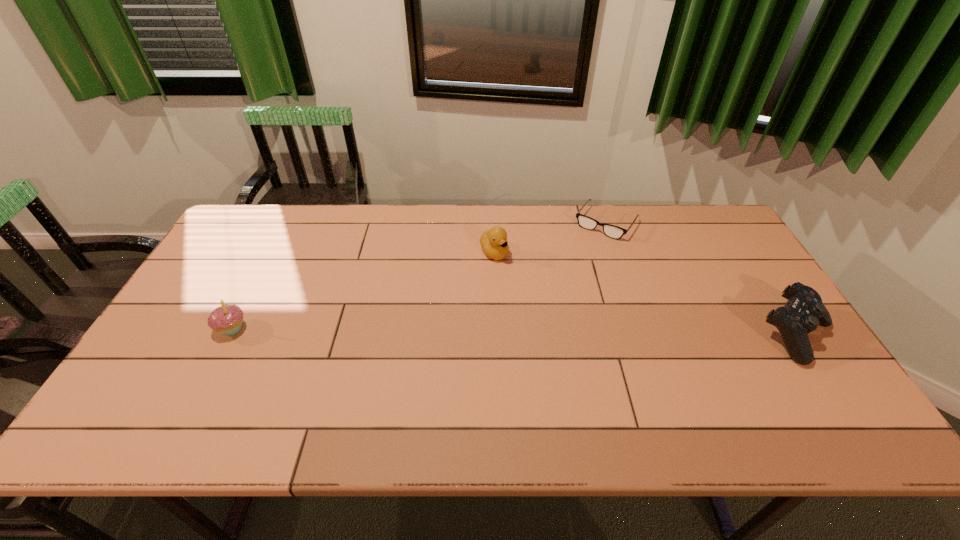
In order to click on vacant space at the right edge in this screenshot , I will do `click(779, 343)`.

In the image, there is a desktop. Where is `vacant area at the far left corner`? This screenshot has height=540, width=960. vacant area at the far left corner is located at coordinates (268, 209).

Identify the location of free space that is in between the second object from right to left and the leftmost object. This screenshot has width=960, height=540. coord(420,275).

This screenshot has height=540, width=960. I want to click on unoccupied position between the control and the third object from right to left, so click(x=645, y=294).

Where is `free space between the shortest object and the leftmost object`? free space between the shortest object and the leftmost object is located at coordinates (420, 275).

The width and height of the screenshot is (960, 540). I want to click on free point between the leftmost object and the control, so click(x=514, y=332).

Where is `free space between the rightmost object and the cupcake`? The width and height of the screenshot is (960, 540). free space between the rightmost object and the cupcake is located at coordinates (514, 332).

I want to click on vacant space that's between the second object from right to left and the rightmost object, so click(701, 279).

You are a GUI agent. You are given a task and a screenshot of the screen. Output one action in this format:
    pyautogui.click(x=<x>, y=<y>)
    Task: Click on the free point between the second object from left to right and the control
    The width and height of the screenshot is (960, 540).
    Given the screenshot: What is the action you would take?
    pyautogui.click(x=645, y=294)

You are a GUI agent. You are given a task and a screenshot of the screen. Output one action in this format:
    pyautogui.click(x=<x>, y=<y>)
    Task: Click on the vacant space that is in between the rightmost object and the cupcake
    
    Given the screenshot: What is the action you would take?
    [514, 332]